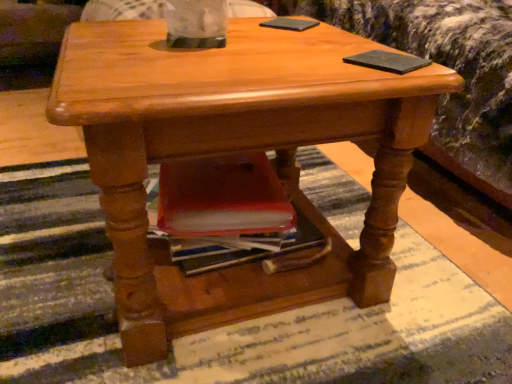
You are a GUI agent. You are given a task and a screenshot of the screen. Output one action in this format:
    pyautogui.click(x=<x>, y=<y>)
    Task: Click on the free spot in front of green matte pad at upper center, the 2th pad from the front
    Image resolution: width=512 pixels, height=384 pixels.
    Given the screenshot: What is the action you would take?
    pyautogui.click(x=292, y=41)